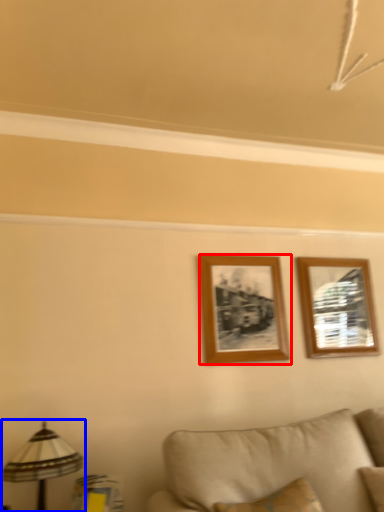
Question: Which object is closer to the camera taking this photo, picture frame (highlighted by a red box) or table lamp (highlighted by a blue box)?

Choices:
 (A) picture frame
 (B) table lamp

Answer: (B)